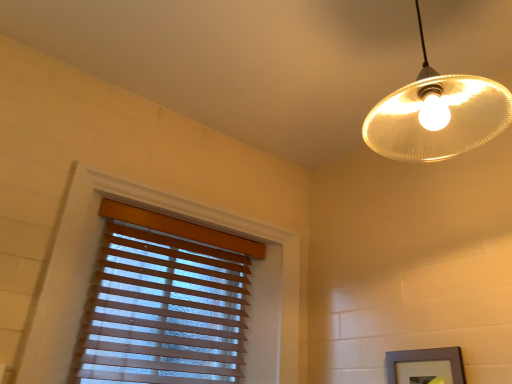
Question: Is translucent glass lampshade at upper right located within gray matte picture frame at lower right?

Choices:
 (A) yes
 (B) no

Answer: (B)

Question: Is gray matte picture frame at lower right further to camera compared to translucent glass lampshade at upper right?

Choices:
 (A) no
 (B) yes

Answer: (B)

Question: From the image's perspective, is gray matte picture frame at lower right on top of translucent glass lampshade at upper right?

Choices:
 (A) no
 (B) yes

Answer: (A)

Question: From a real-world perspective, is gray matte picture frame at lower right positioned over translucent glass lampshade at upper right based on gravity?

Choices:
 (A) yes
 (B) no

Answer: (B)

Question: Is gray matte picture frame at lower right at the right side of translucent glass lampshade at upper right?

Choices:
 (A) no
 (B) yes

Answer: (B)

Question: In terms of size, does wooden blinds at left appear bigger or smaller than translucent glass lampshade at upper right?

Choices:
 (A) big
 (B) small

Answer: (A)

Question: Choose the correct answer: Is wooden blinds at left inside translucent glass lampshade at upper right or outside it?

Choices:
 (A) inside
 (B) outside

Answer: (B)

Question: Is wooden blinds at left taller or shorter than translucent glass lampshade at upper right?

Choices:
 (A) short
 (B) tall

Answer: (B)

Question: From the image's perspective, is wooden blinds at left positioned above or below translucent glass lampshade at upper right?

Choices:
 (A) above
 (B) below

Answer: (B)

Question: Looking at the image, does translucent glass lampshade at upper right seem bigger or smaller compared to wooden blinds at left?

Choices:
 (A) small
 (B) big

Answer: (A)

Question: Considering the positions of translucent glass lampshade at upper right and wooden blinds at left in the image, is translucent glass lampshade at upper right taller or shorter than wooden blinds at left?

Choices:
 (A) short
 (B) tall

Answer: (A)

Question: From a real-world perspective, is translucent glass lampshade at upper right physically located above or below wooden blinds at left?

Choices:
 (A) above
 (B) below

Answer: (A)

Question: Considering the positions of point (417, 115) and point (211, 299), is point (417, 115) closer or farther from the camera than point (211, 299)?

Choices:
 (A) farther
 (B) closer

Answer: (B)

Question: From the image's perspective, relative to gray matte picture frame at lower right, is translucent glass lampshade at upper right above or below?

Choices:
 (A) below
 (B) above

Answer: (B)

Question: Visually, is translucent glass lampshade at upper right positioned to the left or to the right of gray matte picture frame at lower right?

Choices:
 (A) right
 (B) left

Answer: (B)